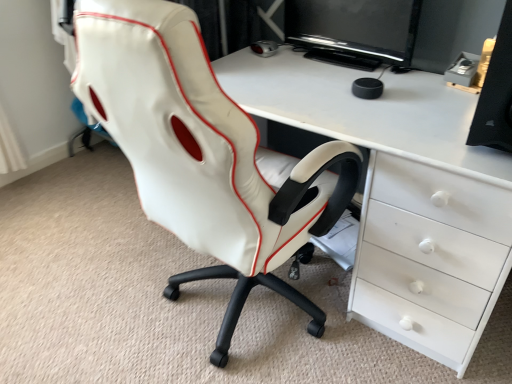
Where is `free space behind black matte speaker at right`? This screenshot has width=512, height=384. free space behind black matte speaker at right is located at coordinates (436, 92).